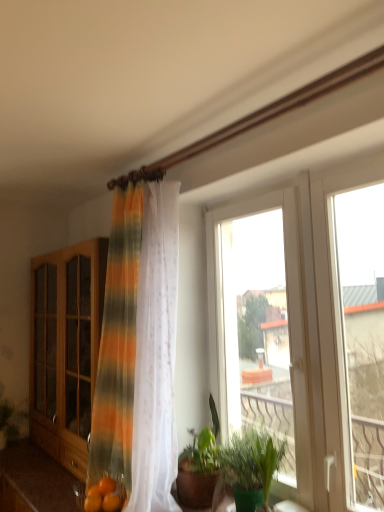
Image resolution: width=384 pixels, height=512 pixels. What do you see at coordinates (66, 348) in the screenshot?
I see `wooden cabinet at left` at bounding box center [66, 348].

Describe the element at coordinates (7, 422) in the screenshot. I see `green matte plant at lower left, acting as the first plant starting from the back` at that location.

Locate an element on the screen. wooden cabinet at left is located at coordinates (66, 348).

Can you confirm if transparent glass window at right, which is the 1th window from right to left, is smaller than orange matte citrus fruit at lower left, the 1th citrus fruit viewed from the front?

Incorrect, transparent glass window at right, which is the 1th window from right to left, is not smaller in size than orange matte citrus fruit at lower left, the 1th citrus fruit viewed from the front.

Identify the location of the 1st citrus fruit behind the transparent glass window at right, the 3th window when ordered from left to right. (111, 502).

Considering the sizes of transparent glass window at right, which is the 1th window from right to left, and orange matte citrus fruit at lower left, the 1th citrus fruit viewed from the front, in the image, is transparent glass window at right, which is the 1th window from right to left, wider or thinner than orange matte citrus fruit at lower left, the 1th citrus fruit viewed from the front,?

In the image, transparent glass window at right, which is the 1th window from right to left, appears to be wider than orange matte citrus fruit at lower left, the 1th citrus fruit viewed from the front.

Is transparent glass window at right, the 3th window when ordered from left to right, further to the viewer compared to orange matte citrus fruit at lower left, the 1th citrus fruit viewed from the front?

No.

Would you say green matte plant at lower left, the second plant viewed from the right, is inside or outside transparent glass window at right, the 3th window when ordered from left to right?

green matte plant at lower left, the second plant viewed from the right, exists outside the volume of transparent glass window at right, the 3th window when ordered from left to right.

Is green matte plant at lower left, the second plant viewed from the right, next to transparent glass window at right, the 3th window when ordered from left to right?

green matte plant at lower left, the second plant viewed from the right, and transparent glass window at right, the 3th window when ordered from left to right, are clearly separated.

Is point (11, 413) closer or farther from the camera than point (327, 339)?

Clearly, point (11, 413) is more distant from the camera than point (327, 339).

Considering the positions of objects green matte plant at lower left, the 2th plant in the front-to-back sequence, and orange matte citrus fruit at lower left, acting as the second citrus fruit starting from the back, in the image provided, who is more to the left, green matte plant at lower left, the 2th plant in the front-to-back sequence, or orange matte citrus fruit at lower left, acting as the second citrus fruit starting from the back,?

green matte plant at lower left, the 2th plant in the front-to-back sequence.

Considering the relative sizes of green matte plant at lower left, acting as the first plant starting from the back, and orange matte citrus fruit at lower left, the 1th citrus fruit viewed from the front, in the image provided, is green matte plant at lower left, acting as the first plant starting from the back, taller than orange matte citrus fruit at lower left, the 1th citrus fruit viewed from the front,?

Correct, green matte plant at lower left, acting as the first plant starting from the back, is much taller as orange matte citrus fruit at lower left, the 1th citrus fruit viewed from the front.

Between point (17, 430) and point (114, 498), which one is positioned in front?

Positioned in front is point (114, 498).

Find the location of a particular element. The width and height of the screenshot is (384, 512). the 1st plant located above the orange matte citrus fruit at lower left, acting as the second citrus fruit starting from the back (from a real-world perspective) is located at coordinates (7, 422).

From a real-world perspective, does orange matte citrus fruit at lower left, placed as the 1th citrus fruit when sorted from back to front, sit lower than green leafy plant at center, the 1th houseplant from the left?

Yes, from a real-world perspective, orange matte citrus fruit at lower left, placed as the 1th citrus fruit when sorted from back to front, is under green leafy plant at center, the 1th houseplant from the left.

From the image's perspective, which is above, orange matte citrus fruit at lower left, placed as the 1th citrus fruit when sorted from back to front, or green leafy plant at center, arranged as the second houseplant when viewed from the right?

green leafy plant at center, arranged as the second houseplant when viewed from the right, appears higher in the image.

Is orange matte citrus fruit at lower left, positioned as the 2th citrus fruit in front-to-back order, further to the viewer compared to green leafy plant at center, the 1th houseplant from the left?

That is True.

Are orange matte citrus fruit at lower left, placed as the 1th citrus fruit when sorted from back to front, and green leafy plant at center, the 1th houseplant from the left, making contact?

No, orange matte citrus fruit at lower left, placed as the 1th citrus fruit when sorted from back to front, is not in contact with green leafy plant at center, the 1th houseplant from the left.

From a real-world perspective, is green leafy plant at lower right, positioned as the 2th houseplant in left-to-right order, located higher than white plastic window at center, marked as the 2th window in a left-to-right arrangement?

No, from a real-world perspective, green leafy plant at lower right, positioned as the 2th houseplant in left-to-right order, is not above white plastic window at center, marked as the 2th window in a left-to-right arrangement.

How many degrees apart are the facing directions of green leafy plant at lower right, positioned as the 2th houseplant in left-to-right order, and white plastic window at center, marked as the 2th window in a left-to-right arrangement?

The angle between the facing direction of green leafy plant at lower right, positioned as the 2th houseplant in left-to-right order, and the facing direction of white plastic window at center, marked as the 2th window in a left-to-right arrangement, is 0.049 degrees.

From the image's perspective, which one is positioned higher, green leafy plant at lower right, positioned as the 2th houseplant in left-to-right order, or white plastic window at center, positioned as the second window in right-to-left order?

white plastic window at center, positioned as the second window in right-to-left order, from the image's perspective.

Is green leafy plant at lower right, positioned as the 2th houseplant in left-to-right order, facing towards white plastic window at center, positioned as the second window in right-to-left order?

No, green leafy plant at lower right, positioned as the 2th houseplant in left-to-right order, is not oriented towards white plastic window at center, positioned as the second window in right-to-left order.

Which object is wider, striped sheer curtain at center or green leafy plant at lower right, positioned as the 2th houseplant in left-to-right order?

striped sheer curtain at center is wider.

How different are the orientations of striped sheer curtain at center and green leafy plant at lower right, positioned as the 2th houseplant in left-to-right order, in degrees?

The facing directions of striped sheer curtain at center and green leafy plant at lower right, positioned as the 2th houseplant in left-to-right order, are 0.00051 degrees apart.

Is point (135, 276) positioned in front of point (259, 490)?

No.

Looking at this image, is striped sheer curtain at center located outside green leafy plant at lower right, positioned as the 2th houseplant in left-to-right order?

Yes, striped sheer curtain at center is outside of green leafy plant at lower right, positioned as the 2th houseplant in left-to-right order.

In terms of width, does white plastic window at center, marked as the 2th window in a left-to-right arrangement, look wider or thinner when compared to orange matte citrus fruit at lower left, placed as the 1th citrus fruit when sorted from back to front?

white plastic window at center, marked as the 2th window in a left-to-right arrangement, is thinner than orange matte citrus fruit at lower left, placed as the 1th citrus fruit when sorted from back to front.

Is white plastic window at center, marked as the 2th window in a left-to-right arrangement, oriented towards orange matte citrus fruit at lower left, placed as the 1th citrus fruit when sorted from back to front?

Yes, white plastic window at center, marked as the 2th window in a left-to-right arrangement, is turned towards orange matte citrus fruit at lower left, placed as the 1th citrus fruit when sorted from back to front.

From the image's perspective, which object appears higher, white plastic window at center, positioned as the second window in right-to-left order, or orange matte citrus fruit at lower left, placed as the 1th citrus fruit when sorted from back to front?

white plastic window at center, positioned as the second window in right-to-left order, appears higher in the image.

Is white plastic window at center, positioned as the second window in right-to-left order, far from orange matte citrus fruit at lower left, positioned as the 2th citrus fruit in front-to-back order?

Absolutely, white plastic window at center, positioned as the second window in right-to-left order, is distant from orange matte citrus fruit at lower left, positioned as the 2th citrus fruit in front-to-back order.

Locate an element on the screen. This screenshot has width=384, height=512. the 3rd window counting from the right side of the orange matte citrus fruit at lower left, the 1th citrus fruit viewed from the front is located at coordinates click(x=335, y=325).

Identify the location of the 2nd plant counting from the left of the transparent glass window at right, which is the 1th window from right to left. Image resolution: width=384 pixels, height=512 pixels. (7, 422).

When comparing their distances from transparent glass window at right, the 3th window when ordered from left to right, does striped sheer curtain at center or green leafy plant at center, arranged as the second houseplant when viewed from the right, seem closer?

green leafy plant at center, arranged as the second houseplant when viewed from the right.

Estimate the real-world distances between objects in this image. Which object is further from orange matte citrus fruit at lower left, positioned as the 2th citrus fruit in front-to-back order, wooden cabinet at left or striped sheer curtain at center?

wooden cabinet at left is positioned further to the anchor orange matte citrus fruit at lower left, positioned as the 2th citrus fruit in front-to-back order.

From the picture: Based on their spatial positions, is striped sheer curtain at center or orange matte citrus fruit at lower left, placed as the 1th citrus fruit when sorted from back to front, further from transparent glass window at right, which is the 1th window from right to left?

orange matte citrus fruit at lower left, placed as the 1th citrus fruit when sorted from back to front, lies further to transparent glass window at right, which is the 1th window from right to left, than the other object.

Consider the image. When comparing their distances from transparent glass window at center, which is counted as the first window, starting from the left, does striped sheer curtain at center or orange matte citrus fruit at lower left, placed as the 1th citrus fruit when sorted from back to front, seem further?

Based on the image, orange matte citrus fruit at lower left, placed as the 1th citrus fruit when sorted from back to front, appears to be further to transparent glass window at center, which is counted as the first window, starting from the left.

When comparing their distances from green matte plant at lower left, acting as the first plant starting from the back, does transparent glass window at center, which is counted as the first window, starting from the left, or green leafy plant at center, arranged as the second houseplant when viewed from the right, seem closer?

Based on the image, green leafy plant at center, arranged as the second houseplant when viewed from the right, appears to be nearer to green matte plant at lower left, acting as the first plant starting from the back.

Based on their spatial positions, is green leafy plant at center, arranged as the second houseplant when viewed from the right, or wooden cabinet at left further from transparent glass window at right, which is the 1th window from right to left?

Among the two, wooden cabinet at left is located further to transparent glass window at right, which is the 1th window from right to left.

Considering their positions, is orange matte citrus fruit at lower left, the 1th citrus fruit viewed from the front, positioned closer to white plastic window at center, positioned as the second window in right-to-left order, than green leafy plant at lower right, the second plant in the left-to-right sequence?

The object closer to white plastic window at center, positioned as the second window in right-to-left order, is green leafy plant at lower right, the second plant in the left-to-right sequence.

From the image, which object appears to be nearer to transparent glass window at right, which is the 1th window from right to left, green matte plant at lower left, which is counted as the 1th plant, starting from the left, or orange matte citrus fruit at lower left, placed as the 1th citrus fruit when sorted from back to front?

orange matte citrus fruit at lower left, placed as the 1th citrus fruit when sorted from back to front.

Locate an element on the screen. The width and height of the screenshot is (384, 512). window situated between orange matte citrus fruit at lower left, the 1th citrus fruit viewed from the front, and green leafy plant at lower right, the second plant in the left-to-right sequence, from left to right is located at coordinates (270, 323).

At what (x,y) coordinates should I click in order to perform the action: click on cabinetry between green matte plant at lower left, acting as the first plant starting from the back, and green leafy plant at lower right, the first houseplant viewed from the right. Please return your answer as a coordinate pair (x, y). The width and height of the screenshot is (384, 512). Looking at the image, I should click on (66, 348).

In order to click on curtain between orange matte citrus fruit at lower left, placed as the 1th citrus fruit when sorted from back to front, and transparent glass window at right, which is the 1th window from right to left, from left to right in this screenshot , I will do `click(139, 350)`.

Image resolution: width=384 pixels, height=512 pixels. Identify the location of citrus fruit between orange matte citrus fruit at lower left, placed as the 1th citrus fruit when sorted from back to front, and transparent glass window at right, the 3th window when ordered from left to right, in the horizontal direction. (111, 502).